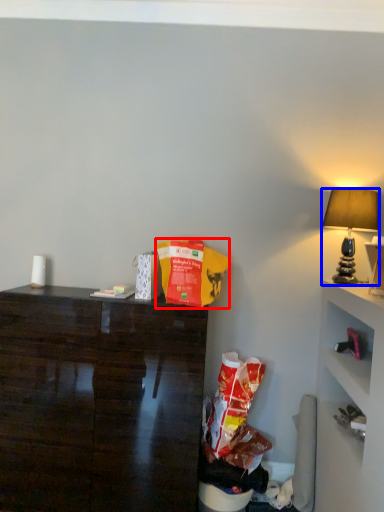
Question: Which object is further to the camera taking this photo, paper bag (highlighted by a red box) or lamp (highlighted by a blue box)?

Choices:
 (A) paper bag
 (B) lamp

Answer: (B)